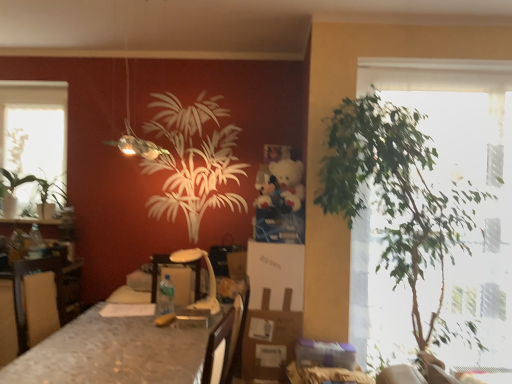
Question: Is green leafy plant at left, the second houseplant viewed from the front, with green leafy plant at right, which is the first houseplant in right-to-left order?

Choices:
 (A) yes
 (B) no

Answer: (B)

Question: Does green leafy plant at left, which appears as the first houseplant when viewed from the back, have a lesser height compared to green leafy plant at right, the 2th houseplant in the left-to-right sequence?

Choices:
 (A) no
 (B) yes

Answer: (B)

Question: Considering the relative positions of green leafy plant at left, which ranks as the 1th houseplant in left-to-right order, and green leafy plant at right, the second houseplant from the back, in the image provided, is green leafy plant at left, which ranks as the 1th houseplant in left-to-right order, in front of green leafy plant at right, the second houseplant from the back,?

Choices:
 (A) yes
 (B) no

Answer: (B)

Question: Is green leafy plant at left, which ranks as the 1th houseplant in left-to-right order, taller than green leafy plant at right, the second houseplant from the back?

Choices:
 (A) no
 (B) yes

Answer: (A)

Question: Considering the relative positions of green leafy plant at left, which ranks as the 1th houseplant in left-to-right order, and green leafy plant at right, the 2th houseplant in the left-to-right sequence, in the image provided, is green leafy plant at left, which ranks as the 1th houseplant in left-to-right order, to the left of green leafy plant at right, the 2th houseplant in the left-to-right sequence, from the viewer's perspective?

Choices:
 (A) yes
 (B) no

Answer: (A)

Question: Considering the relative sizes of green leafy plant at left, which appears as the second houseplant when viewed from the right, and green leafy plant at right, which is the first houseplant in right-to-left order, in the image provided, is green leafy plant at left, which appears as the second houseplant when viewed from the right, thinner than green leafy plant at right, which is the first houseplant in right-to-left order,?

Choices:
 (A) no
 (B) yes

Answer: (B)

Question: Considering the relative sizes of clear glass window at upper left and green leafy plant at left, which ranks as the 1th houseplant in left-to-right order, in the image provided, is clear glass window at upper left taller than green leafy plant at left, which ranks as the 1th houseplant in left-to-right order,?

Choices:
 (A) no
 (B) yes

Answer: (B)

Question: From a real-world perspective, is clear glass window at upper left physically above green leafy plant at left, the second houseplant viewed from the front?

Choices:
 (A) no
 (B) yes

Answer: (B)

Question: Does clear glass window at upper left appear on the left side of green leafy plant at left, which appears as the second houseplant when viewed from the right?

Choices:
 (A) no
 (B) yes

Answer: (B)

Question: Is clear glass window at upper left further to the viewer compared to green leafy plant at left, which ranks as the 1th houseplant in left-to-right order?

Choices:
 (A) no
 (B) yes

Answer: (B)

Question: From the image's perspective, would you say clear glass window at upper left is positioned over green leafy plant at left, the second houseplant viewed from the front?

Choices:
 (A) no
 (B) yes

Answer: (B)

Question: Is clear glass window at upper left touching green leafy plant at left, which ranks as the 1th houseplant in left-to-right order?

Choices:
 (A) yes
 (B) no

Answer: (B)

Question: Can you confirm if green leafy plant at left is bigger than clear glass window at upper left?

Choices:
 (A) no
 (B) yes

Answer: (B)